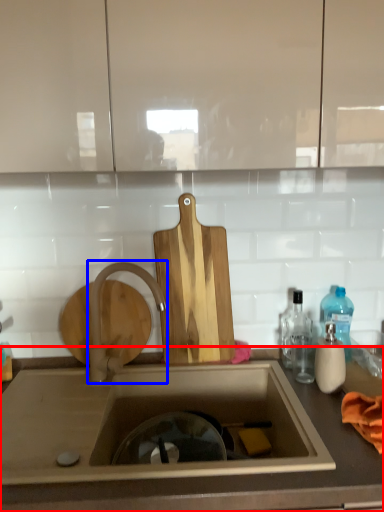
Question: Which of the following is the farthest to the observer, countertop (highlighted by a red box) or tap (highlighted by a blue box)?

Choices:
 (A) countertop
 (B) tap

Answer: (B)